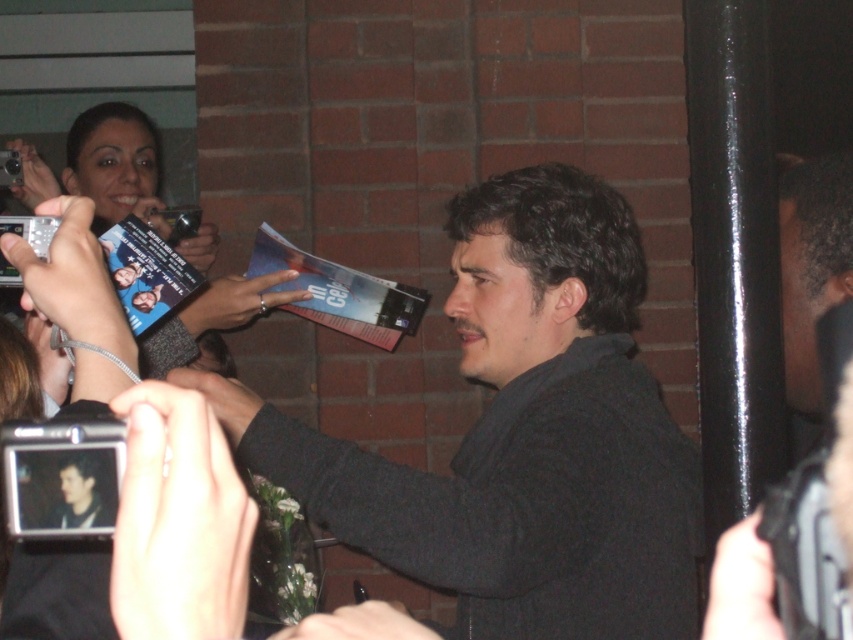
Is dark gray sweater at center further to camera compared to matte black camera at upper left?

No, it is in front of matte black camera at upper left.

Can you confirm if dark gray sweater at center is thinner than matte black camera at upper left?

Correct, dark gray sweater at center's width is less than matte black camera at upper left's.

Locate an element on the screen. dark gray sweater at center is located at coordinates (521, 435).